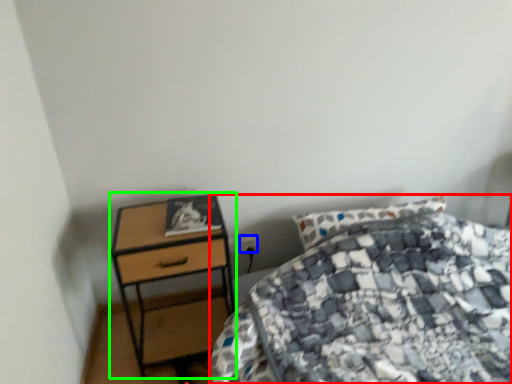
Question: Based on their relative distances, which object is farther from bed (highlighted by a red box)? Choose from power plugs and sockets (highlighted by a blue box) and nightstand (highlighted by a green box).

Choices:
 (A) power plugs and sockets
 (B) nightstand

Answer: (A)